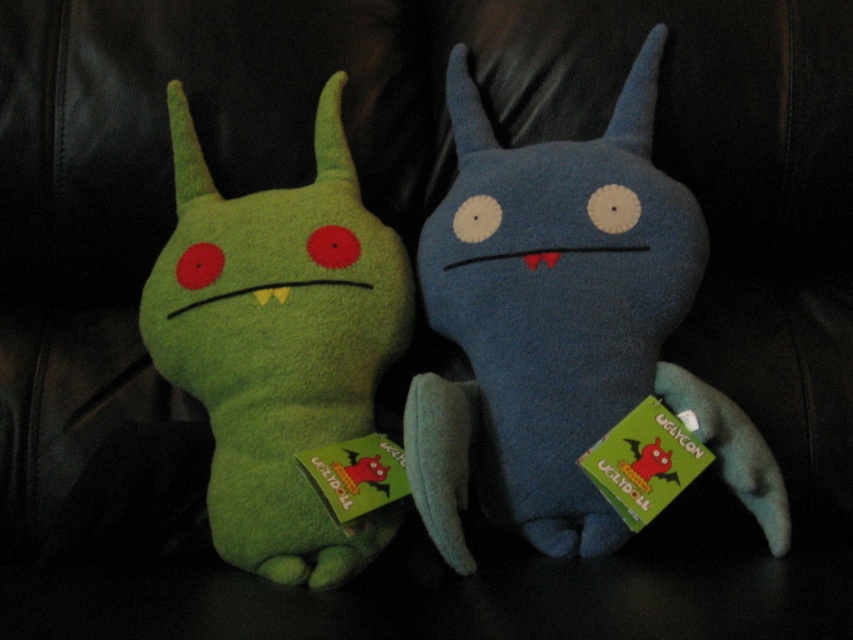
You are arranging a shelf display and need to place the blue plush toy at center and the green plush toy at left. Based on the image, which toy is positioned higher up?

The blue plush toy at center is positioned higher up than the green plush toy at left.

You are sitting on the couch and want to pick up the closest plush toy to you. Which one should you choose between the blue plush toy at center and the green plush toy at left?

The blue plush toy at center is closer to the viewer, so you should choose the blue plush toy at center.